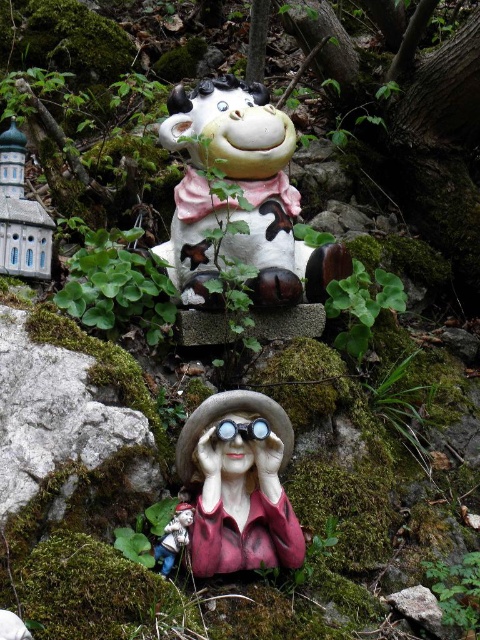
Question: Which of these objects is positioned closest to the matte pink porcelain doll at center?

Choices:
 (A) wooden gnome at lower center
 (B) matte ceramic cow at center

Answer: (A)

Question: Does matte ceramic cow at center have a lesser width compared to matte pink porcelain doll at center?

Choices:
 (A) no
 (B) yes

Answer: (A)

Question: Does matte ceramic cow at center have a larger size compared to wooden gnome at lower center?

Choices:
 (A) no
 (B) yes

Answer: (B)

Question: Which point is farther to the camera?

Choices:
 (A) (184, 544)
 (B) (38, 204)
 (C) (222, 160)
 (D) (269, 445)

Answer: (B)

Question: Which of the following is the farthest from the observer?

Choices:
 (A) (276, 435)
 (B) (26, 241)

Answer: (B)

Question: From the image, what is the correct spatial relationship of matte ceramic cow at center in relation to matte pink porcelain doll at center?

Choices:
 (A) above
 (B) below

Answer: (A)